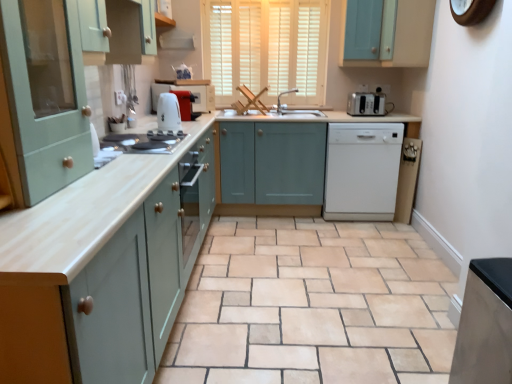
Question: Is matte wood countertop at center in front of matte white toaster at center, the 3th home appliance in the front-to-back sequence?

Choices:
 (A) yes
 (B) no

Answer: (A)

Question: Is matte wood countertop at center turned away from matte white toaster at center, the 3th home appliance in the front-to-back sequence?

Choices:
 (A) yes
 (B) no

Answer: (B)

Question: Does matte wood countertop at center have a smaller size compared to matte white toaster at center, which is counted as the first home appliance, starting from the left?

Choices:
 (A) no
 (B) yes

Answer: (A)

Question: Is matte wood countertop at center to the left of matte white toaster at center, the 3th home appliance in the front-to-back sequence, from the viewer's perspective?

Choices:
 (A) no
 (B) yes

Answer: (A)

Question: Does matte wood countertop at center have a lesser height compared to matte white toaster at center, which is counted as the first home appliance, starting from the left?

Choices:
 (A) no
 (B) yes

Answer: (A)

Question: Based on their positions, is beige ceramic tile at center located to the left or right of white glossy exhaust hood at upper center?

Choices:
 (A) left
 (B) right

Answer: (B)

Question: Looking at the image, does beige ceramic tile at center seem bigger or smaller compared to white glossy exhaust hood at upper center?

Choices:
 (A) small
 (B) big

Answer: (B)

Question: Considering the positions of beige ceramic tile at center and white glossy exhaust hood at upper center in the image, is beige ceramic tile at center wider or thinner than white glossy exhaust hood at upper center?

Choices:
 (A) thin
 (B) wide

Answer: (B)

Question: Is beige ceramic tile at center in front of or behind white glossy exhaust hood at upper center in the image?

Choices:
 (A) behind
 (B) front

Answer: (B)

Question: Is satin silver fridge at lower right, the 1th home appliance when ordered from front to back, bigger or smaller than matte wood countertop at center?

Choices:
 (A) big
 (B) small

Answer: (B)

Question: Relative to matte wood countertop at center, is satin silver fridge at lower right, acting as the 3th home appliance starting from the right, in front or behind?

Choices:
 (A) front
 (B) behind

Answer: (B)

Question: Looking at their shapes, would you say satin silver fridge at lower right, acting as the 3th home appliance starting from the right, is wider or thinner than matte wood countertop at center?

Choices:
 (A) wide
 (B) thin

Answer: (B)

Question: Is satin silver fridge at lower right, acting as the 3th home appliance starting from the right, taller or shorter than matte wood countertop at center?

Choices:
 (A) short
 (B) tall

Answer: (A)

Question: Considering the positions of point (281, 94) and point (362, 167), is point (281, 94) closer or farther from the camera than point (362, 167)?

Choices:
 (A) closer
 (B) farther

Answer: (B)

Question: From their relative heights in the image, would you say matte silver faucet at center is taller or shorter than white matte dishwasher at center, the 3th home appliance when ordered from left to right?

Choices:
 (A) tall
 (B) short

Answer: (B)